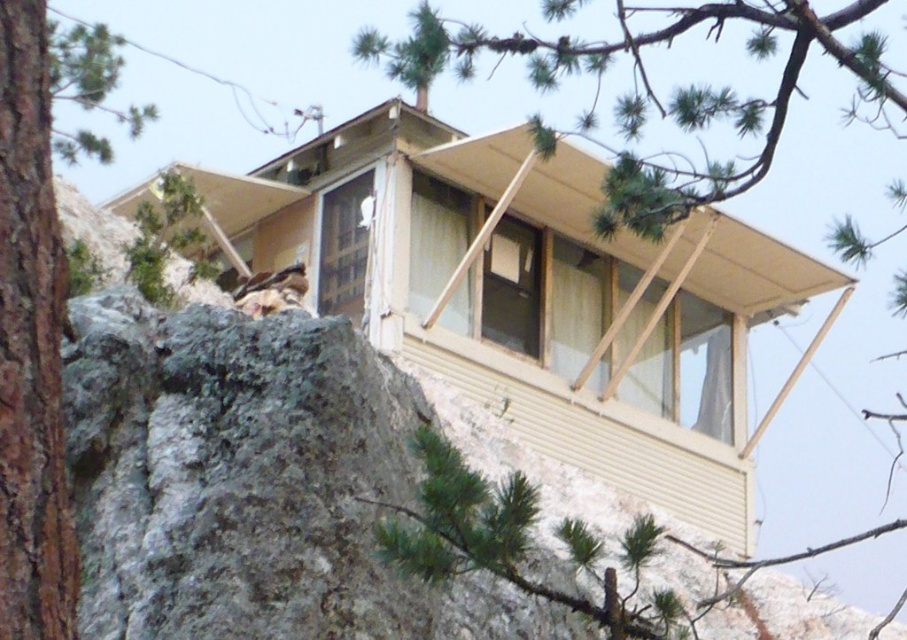
You are standing at the base of the cliff and looking up at the fire lookout tower. You see a green pine tree at upper center and a brown rough bark tree at left. Which tree is closer to you?

The green pine tree at upper center is closer to you because it is positioned further to the viewer than the brown rough bark tree at left.

Consider the image. You are standing at the base of the cliff near the lookout tower and want to take a photo of the green pine tree at upper center. Based on its coordinates, is the tree positioned to the left or right side of the image?

The green pine tree at upper center is located at point (652, 93). Since the x coordinate is 0.147, which is less than 0.5, the tree is positioned to the left side of the image.

You are a hiker who wants to take a photo of both the green pine tree at upper center and the brown rough bark tree at left. Which tree should you stand closer to in order to capture both in the same frame?

You should stand closer to the brown rough bark tree at left because the green pine tree at upper center is larger in size than the brown rough bark tree at left, so by moving closer to the smaller tree, both can be framed together.